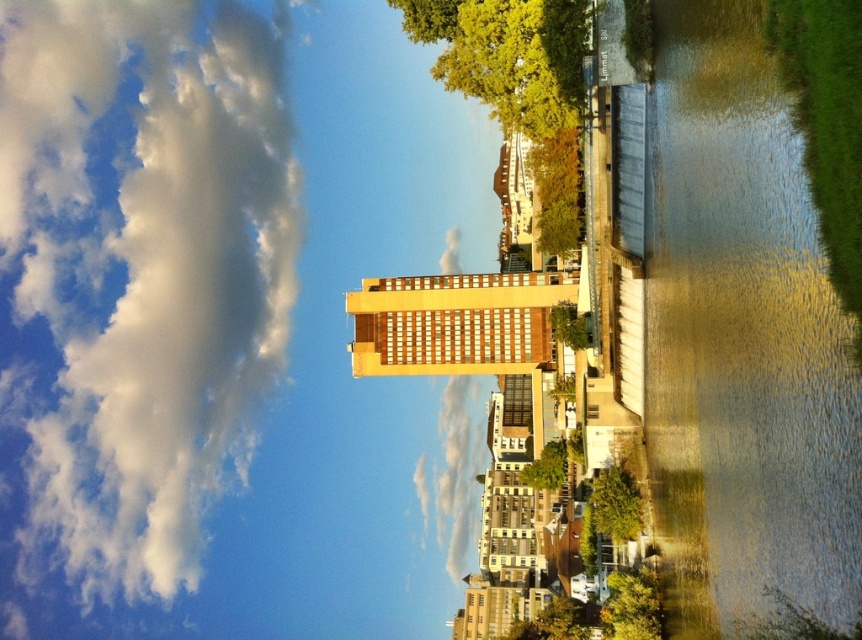
Question: Which point is closer to the camera?

Choices:
 (A) (556, 314)
 (B) (631, 632)
 (C) (461, 516)

Answer: (B)

Question: Can you confirm if white fluffy cloud at upper left is thinner than green leafy tree at lower center?

Choices:
 (A) yes
 (B) no

Answer: (B)

Question: Which object is closer to the camera taking this photo?

Choices:
 (A) clear water at right
 (B) green leafy tree at lower center

Answer: (A)

Question: Is white fluffy cloud at upper left wider than green leafy tree at lower right?

Choices:
 (A) no
 (B) yes

Answer: (B)

Question: Does white fluffy cloud at center have a lesser width compared to green leafy tree at lower center?

Choices:
 (A) yes
 (B) no

Answer: (B)

Question: Estimate the real-world distances between objects in this image. Which object is farther from the white fluffy cloud at upper left?

Choices:
 (A) white fluffy cloud at center
 (B) green leafy tree at lower center

Answer: (B)